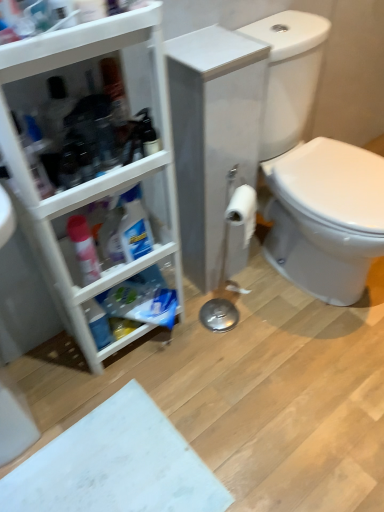
Question: Is white plastic cabinet at left wider than white matte toilet paper at center?

Choices:
 (A) no
 (B) yes

Answer: (B)

Question: Does white plastic cabinet at left lie behind white matte toilet paper at center?

Choices:
 (A) yes
 (B) no

Answer: (B)

Question: Would you consider white plastic cabinet at left to be distant from white matte toilet paper at center?

Choices:
 (A) no
 (B) yes

Answer: (A)

Question: Does white plastic cabinet at left have a greater height compared to white matte toilet paper at center?

Choices:
 (A) yes
 (B) no

Answer: (A)

Question: Considering the relative sizes of white plastic cabinet at left and white matte toilet paper at center in the image provided, is white plastic cabinet at left bigger than white matte toilet paper at center?

Choices:
 (A) no
 (B) yes

Answer: (B)

Question: Considering the positions of white plastic cabinet at left and translucent plastic spray bottle at left in the image, is white plastic cabinet at left wider or thinner than translucent plastic spray bottle at left?

Choices:
 (A) wide
 (B) thin

Answer: (A)

Question: Is white plastic cabinet at left inside the boundaries of translucent plastic spray bottle at left, or outside?

Choices:
 (A) inside
 (B) outside

Answer: (B)

Question: Considering their positions, is white plastic cabinet at left located in front of or behind translucent plastic spray bottle at left?

Choices:
 (A) behind
 (B) front

Answer: (B)

Question: From their relative heights in the image, would you say white plastic cabinet at left is taller or shorter than translucent plastic spray bottle at left?

Choices:
 (A) short
 (B) tall

Answer: (B)

Question: From the image's perspective, relative to white matte toilet paper at center, is white glossy toilet at right above or below?

Choices:
 (A) above
 (B) below

Answer: (A)

Question: Considering the relative positions of white glossy toilet at right and white matte toilet paper at center in the image provided, is white glossy toilet at right to the left or to the right of white matte toilet paper at center?

Choices:
 (A) right
 (B) left

Answer: (A)

Question: Choose the correct answer: Is white glossy toilet at right inside white matte toilet paper at center or outside it?

Choices:
 (A) inside
 (B) outside

Answer: (B)

Question: From a real-world perspective, is white glossy toilet at right above or below white matte toilet paper at center?

Choices:
 (A) above
 (B) below

Answer: (B)

Question: Considering the positions of white plastic cabinet at left and white glossy toilet at right in the image, is white plastic cabinet at left taller or shorter than white glossy toilet at right?

Choices:
 (A) tall
 (B) short

Answer: (A)

Question: Considering the relative positions of white plastic cabinet at left and white glossy toilet at right in the image provided, is white plastic cabinet at left to the left or to the right of white glossy toilet at right?

Choices:
 (A) right
 (B) left

Answer: (B)